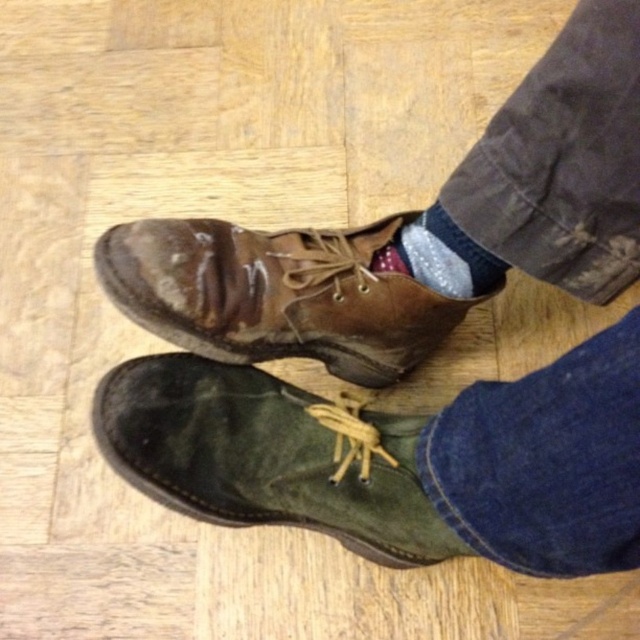
Question: Which object appears closest to the camera in this image?

Choices:
 (A) green suede boot at lower left
 (B) brown suede boot at center
 (C) sparkly silver sock at center

Answer: (A)

Question: Does brown suede boot at center appear over sparkly silver sock at center?

Choices:
 (A) yes
 (B) no

Answer: (B)

Question: Does green suede boot at lower left have a lesser width compared to brown suede boot at center?

Choices:
 (A) no
 (B) yes

Answer: (B)

Question: Which of these objects is positioned farthest from the sparkly silver sock at center?

Choices:
 (A) green suede boot at lower left
 (B) brown suede boot at center

Answer: (A)

Question: Can you confirm if green suede boot at lower left is wider than brown suede boot at center?

Choices:
 (A) no
 (B) yes

Answer: (A)

Question: Which object is positioned closest to the sparkly silver sock at center?

Choices:
 (A) green suede boot at lower left
 (B) brown suede boot at center

Answer: (B)